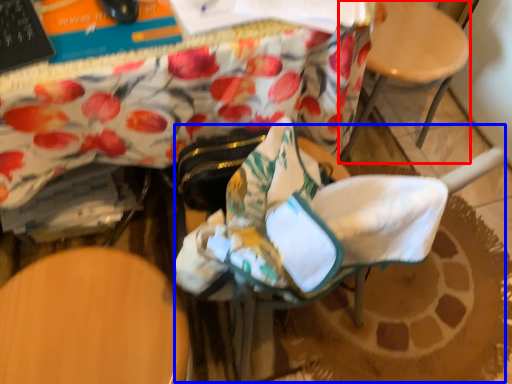
Question: Which of the following is the closest to the observer, chair (highlighted by a red box) or rocking chair (highlighted by a blue box)?

Choices:
 (A) chair
 (B) rocking chair

Answer: (B)